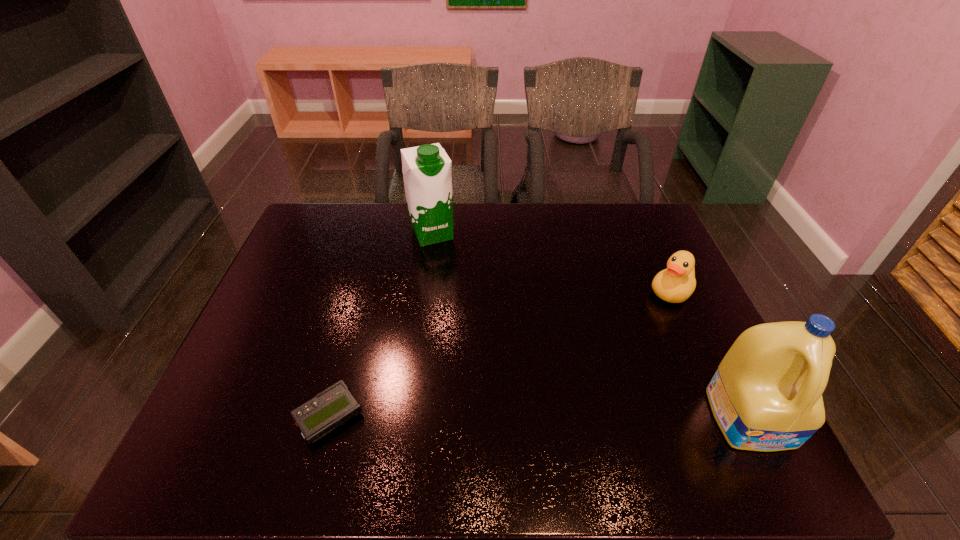
Where is `free space located at the beak of the third tallest object`? The width and height of the screenshot is (960, 540). free space located at the beak of the third tallest object is located at coordinates (638, 327).

Identify the location of vacant space located 0.090m on the front-facing side of the second object from left to right. The height and width of the screenshot is (540, 960). (447, 265).

The image size is (960, 540). Identify the location of vacant position located on the front-facing side of the second object from left to right. (446, 263).

Locate an element on the screen. Image resolution: width=960 pixels, height=540 pixels. free space located 0.290m on the front-facing side of the second object from left to right is located at coordinates (470, 310).

Locate an element on the screen. The width and height of the screenshot is (960, 540). object that is at the far edge is located at coordinates 427,174.

Where is `beeper situated at the near edge`? beeper situated at the near edge is located at coordinates (334, 406).

Find the location of `detergent situated at the near edge`. detergent situated at the near edge is located at coordinates (766, 395).

Locate an element on the screen. detergent that is at the right edge is located at coordinates (766, 395).

Where is `duck positioned at the right edge`? The width and height of the screenshot is (960, 540). duck positioned at the right edge is located at coordinates (675, 284).

I want to click on object present at the near right corner, so click(x=766, y=395).